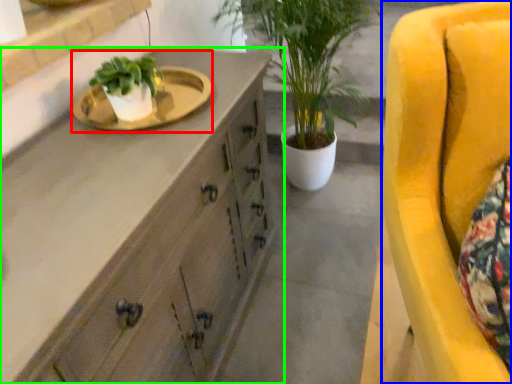
Question: Based on their relative distances, which object is farther from sink (highlighted by a red box)? Choose from chair (highlighted by a blue box) and cabinetry (highlighted by a green box).

Choices:
 (A) chair
 (B) cabinetry

Answer: (A)